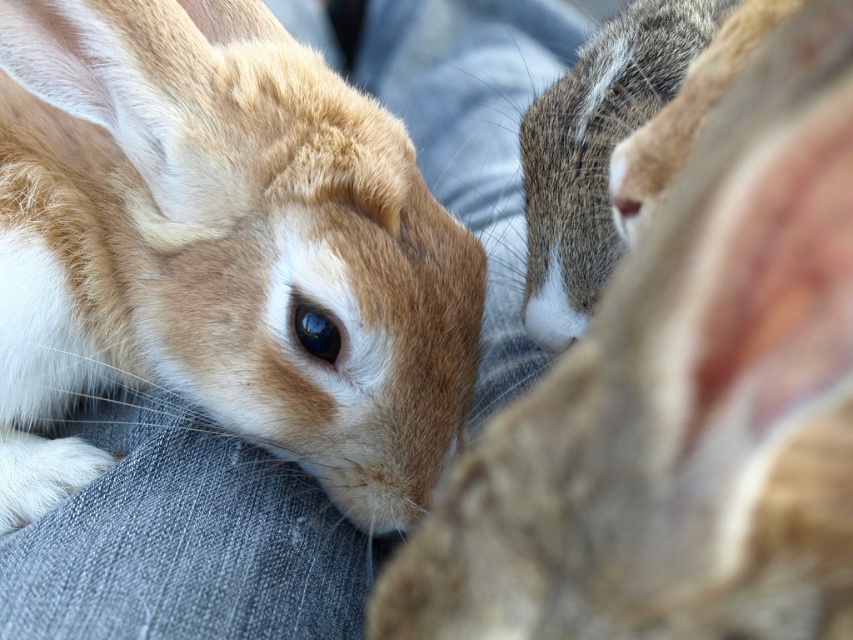
Question: Can you confirm if golden fur rabbit at center is positioned above soft brown fur at center?

Choices:
 (A) yes
 (B) no

Answer: (A)

Question: Does golden fur rabbit at center have a larger size compared to soft brown fur at center?

Choices:
 (A) no
 (B) yes

Answer: (B)

Question: Is golden fur rabbit at center below soft brown fur at center?

Choices:
 (A) yes
 (B) no

Answer: (B)

Question: Among these points, which one is farthest from the camera?

Choices:
 (A) (251, 310)
 (B) (834, 545)

Answer: (A)